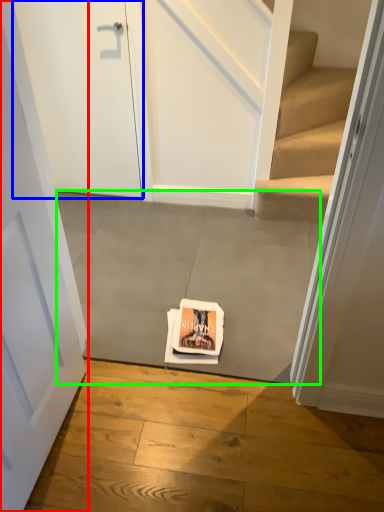
Question: Which object is the closest to the door (highlighted by a red box)? Choose among these: door (highlighted by a blue box) or concrete (highlighted by a green box).

Choices:
 (A) door
 (B) concrete

Answer: (B)